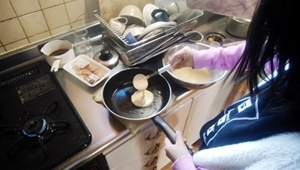
This screenshot has height=170, width=300. Identify the location of bowl of ladle. (140, 77).